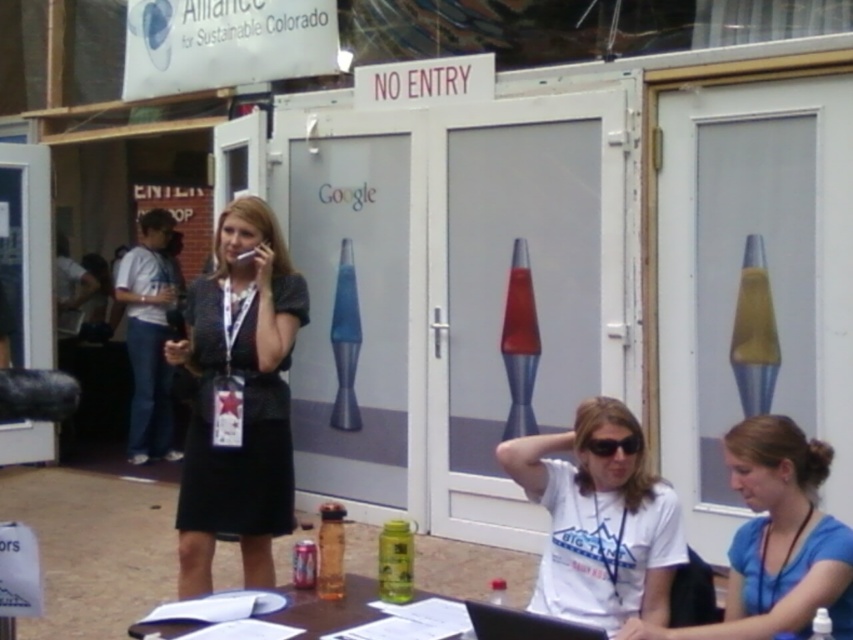
You are a photographer standing at the back of the scene. You need to capture a photo that includes both the white matte shirt at center and the black plastic laptop at lower center. What is the minimum distance you need to move forward to ensure both objects are in frame?

The white matte shirt at center is 21.34 inches from the black plastic laptop at lower center. To ensure both are in frame, you need to move forward until the distance between them appears smaller in your camera view. However, without knowing the camera sensor size or focal length, it is impossible to calculate the exact distance. But since they are only 21.34 inches apart, moving closer by about 12 inches should help include both in the frame.